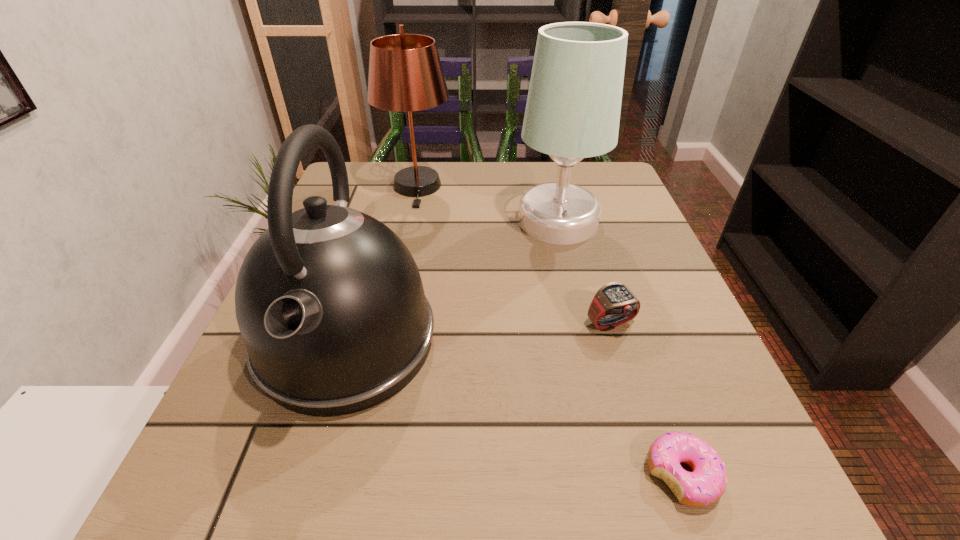
Where is `vacant area between the left lampshade and the nearest object`? vacant area between the left lampshade and the nearest object is located at coordinates pos(549,331).

At what (x,y) coordinates should I click in order to perform the action: click on empty location between the watch and the left lampshade. Please return your answer as a coordinate pair (x, y). The height and width of the screenshot is (540, 960). Looking at the image, I should click on (514, 255).

I want to click on unoccupied area between the watch and the right lampshade, so click(585, 273).

The width and height of the screenshot is (960, 540). I want to click on vacant space in between the left lampshade and the right lampshade, so click(x=488, y=204).

Find the location of a particular element. The height and width of the screenshot is (540, 960). vacant space that is in between the watch and the right lampshade is located at coordinates (585, 273).

The width and height of the screenshot is (960, 540). What are the coordinates of `vacant area that lies between the left lampshade and the doughnut` in the screenshot? It's located at (549, 331).

Locate an element on the screen. free spot between the watch and the nearest object is located at coordinates (646, 399).

Where is `vacant space in between the left lampshade and the right lampshade`? The width and height of the screenshot is (960, 540). vacant space in between the left lampshade and the right lampshade is located at coordinates (488, 204).

Select which object appears as the closest to the left lampshade. Please provide its 2D coordinates. Your answer should be formatted as a tuple, i.e. [(x, y)], where the tuple contains the x and y coordinates of a point satisfying the conditions above.

[(573, 107)]

Identify which object is located as the fourth nearest to the right lampshade. Please provide its 2D coordinates. Your answer should be formatted as a tuple, i.e. [(x, y)], where the tuple contains the x and y coordinates of a point satisfying the conditions above.

[(706, 483)]